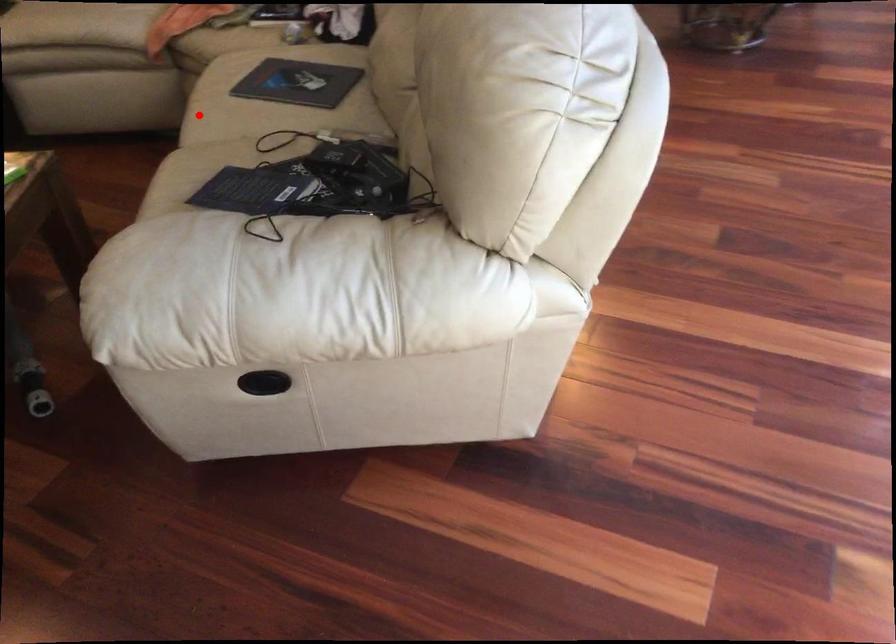
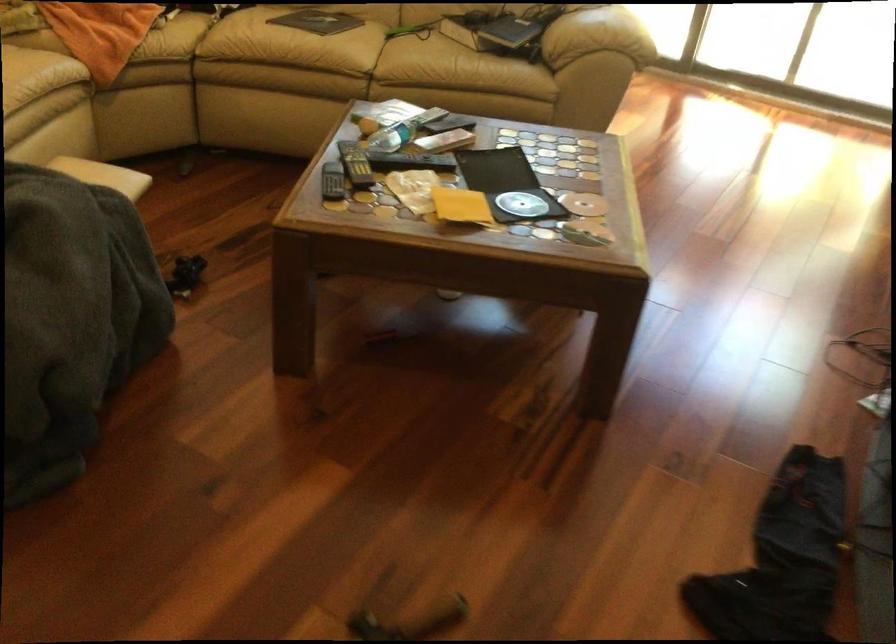
Question: I am providing you with two images of the same scene from different viewpoints. In image1, a red point is highlighted. Considering the same 3D point in image2, which of the following is correct?

Choices:
 (A) It is closer
 (B) It is farther

Answer: (B)